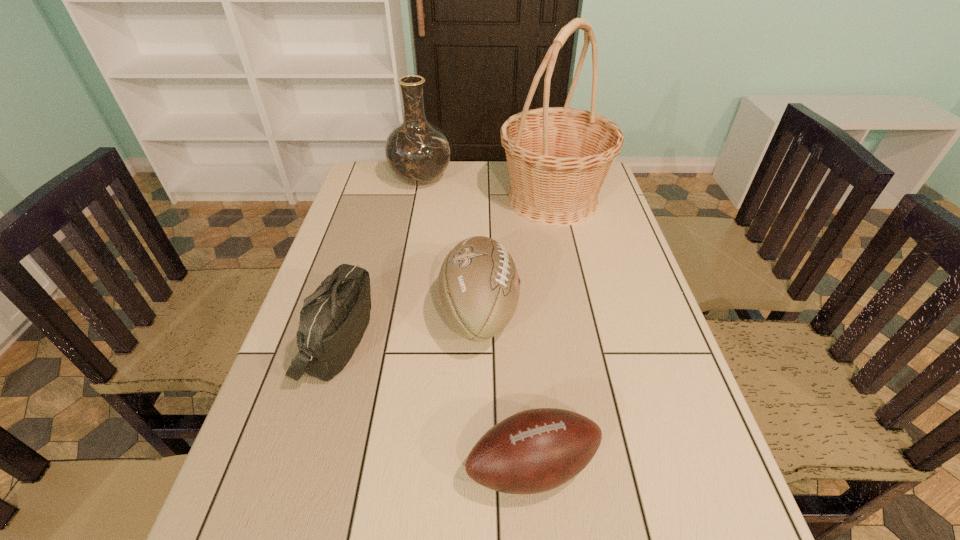
The height and width of the screenshot is (540, 960). Identify the location of free space at the right edge of the desktop. (604, 235).

I want to click on free spot between the shoulder bag and the nearer football (American), so click(435, 404).

This screenshot has width=960, height=540. Find the location of `vacant region between the shoulder bag and the vase`. vacant region between the shoulder bag and the vase is located at coordinates (379, 260).

Image resolution: width=960 pixels, height=540 pixels. I want to click on unoccupied position between the taller football (American) and the shoulder bag, so click(x=409, y=327).

Where is `free area in between the farther football (American) and the nearer football (American)`? This screenshot has width=960, height=540. free area in between the farther football (American) and the nearer football (American) is located at coordinates (506, 390).

You are a GUI agent. You are given a task and a screenshot of the screen. Output one action in this format:
    pyautogui.click(x=<x>, y=<y>)
    Task: Click on the vacant space that's between the taller football (American) and the basket
    This screenshot has width=960, height=540.
    Given the screenshot: What is the action you would take?
    coord(516,256)

What are the coordinates of `blank region between the basket and the vase` in the screenshot? It's located at (487, 190).

Select which object appears as the second closest to the taller football (American). Please provide its 2D coordinates. Your answer should be formatted as a tuple, i.e. [(x, y)], where the tuple contains the x and y coordinates of a point satisfying the conditions above.

[(537, 450)]

Choose which object is the second nearest neighbor to the taller football (American). Please provide its 2D coordinates. Your answer should be formatted as a tuple, i.e. [(x, y)], where the tuple contains the x and y coordinates of a point satisfying the conditions above.

[(537, 450)]

Identify the location of free region that satisfies the following two spatial constraints: 1. on the laces of the taller football (American); 2. on the right side of the nearest object. The width and height of the screenshot is (960, 540). (479, 467).